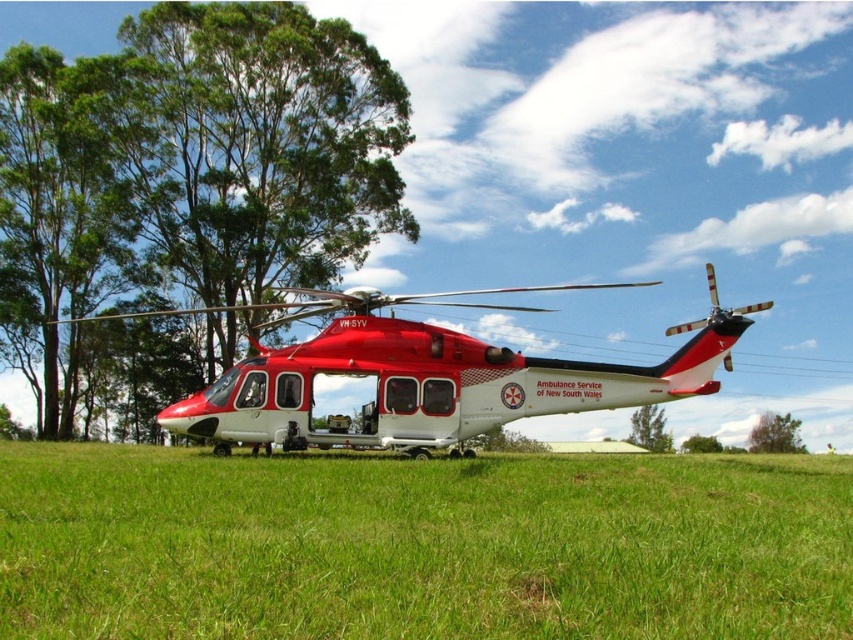
You are standing at the point closest to the helicopter. Which of the two points, point (782, 448) or point (657, 440), is farther away from you?

Point (782, 448) is farther away from you because it is behind point (657, 440).

You are a pilot preparing to take off from the grassy field. You notice a green leafy tree at upper left and a matte red helicopter at center. Which object is positioned higher in the image?

The green leafy tree at upper left is located above the matte red helicopter at center in the image.